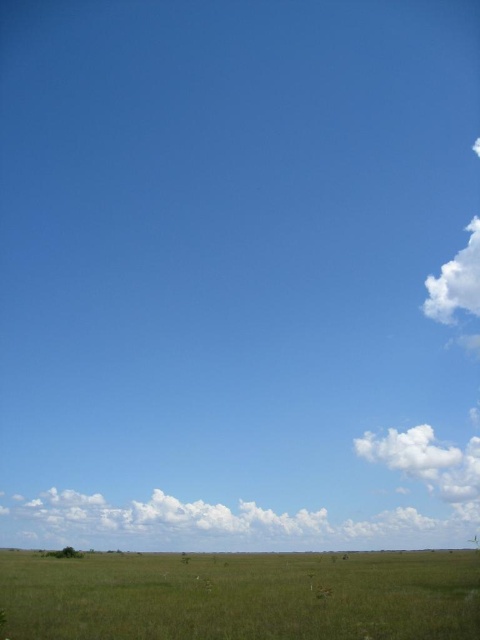
Is point (131, 509) positioned before point (466, 280)?

Yes, it is.

Which is in front, point (313, 547) or point (469, 237)?

Positioned in front is point (313, 547).

Is point (73, 522) positioned before point (479, 260)?

That is True.

This screenshot has height=640, width=480. I want to click on white fluffy cloud at lower center, so click(201, 524).

Does green grassy field at lower center have a lesser height compared to white fluffy cloud at lower center?

Incorrect, green grassy field at lower center's height does not fall short of white fluffy cloud at lower center's.

Who is lower down, green grassy field at lower center or white fluffy cloud at lower center?

white fluffy cloud at lower center

Does point (115, 566) come farther from viewer compared to point (159, 525)?

That is False.

At what (x,y) coordinates should I click in order to perform the action: click on green grassy field at lower center. Please return your answer as a coordinate pair (x, y). The width and height of the screenshot is (480, 640). Looking at the image, I should click on (241, 596).

Image resolution: width=480 pixels, height=640 pixels. What do you see at coordinates (241, 596) in the screenshot? I see `green grassy field at lower center` at bounding box center [241, 596].

Which is behind, point (204, 554) or point (476, 278)?

The point (476, 278) is behind.

What are the coordinates of `green grassy field at lower center` in the screenshot? It's located at pos(241,596).